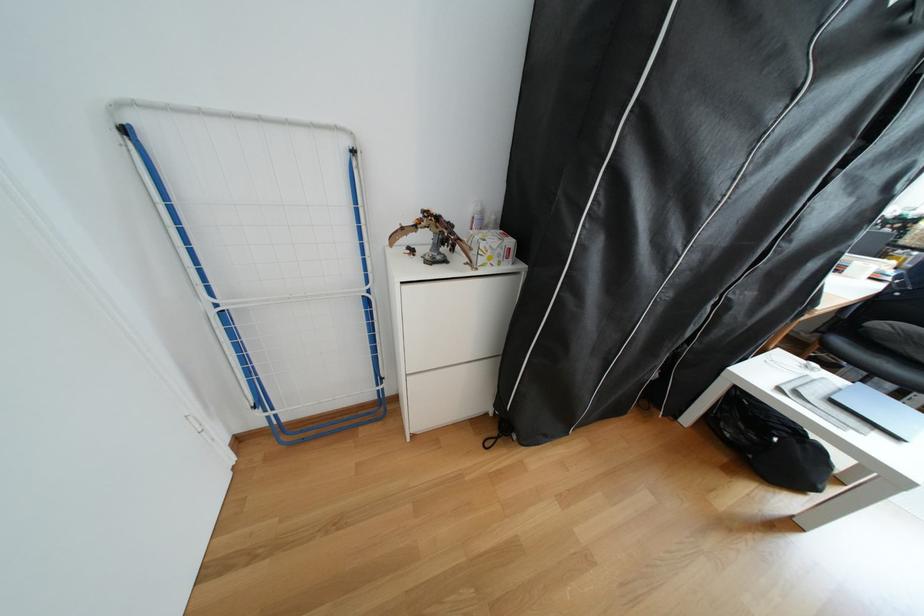
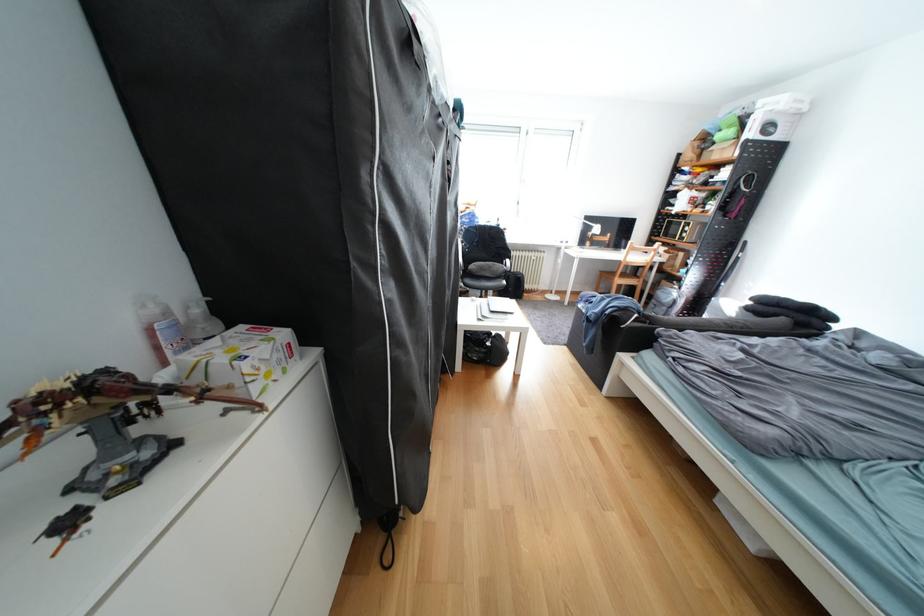
Question: The images are taken continuously from a first-person perspective. In which direction is your viewpoint rotating?

Choices:
 (A) Left
 (B) Right
 (C) Up
 (D) Down

Answer: (B)